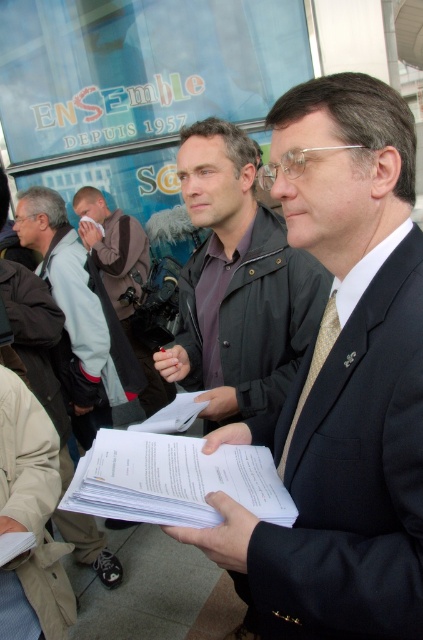
You are an event organizer who needs to arrange seating for two individuals wearing the matte black suit at center and matte black jacket at center. Which one should you place in a seat with more legroom considering their height?

The matte black suit at center is much taller than the matte black jacket at center, so you should place the matte black suit at center in the seat with more legroom.

You are a photographer at the event and need to capture a photo that includes both the matte black suit at center and the white paper at center. Based on their positions, which object should be positioned to the left in your camera frame?

The white paper at center should be positioned to the left in your camera frame because the matte black suit at center is to the right of the white paper at center.

You are a photographer at the event and want to capture a photo where the matte black suit at center and the white paper at center are clearly visible. Based on their positions, which object should be focused on first to ensure both are in frame?

The matte black suit at center is above the white paper at center, so focusing on the matte black suit at center first will ensure both are in frame as the white paper at center is below it.